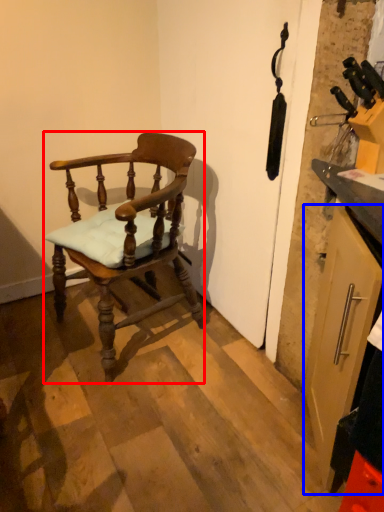
Question: Which point is further to the camera, chair (highlighted by a red box) or cabinetry (highlighted by a blue box)?

Choices:
 (A) chair
 (B) cabinetry

Answer: (A)